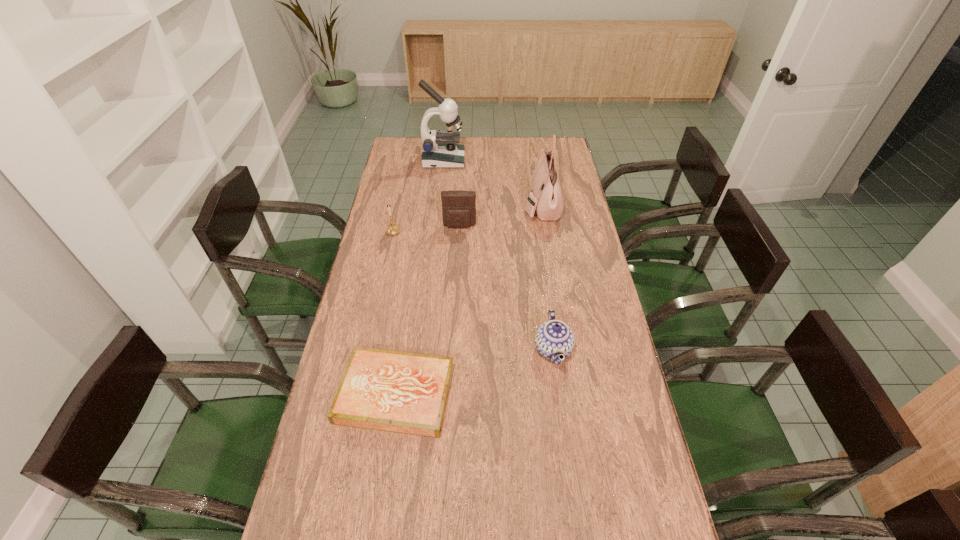
You are a GUI agent. You are given a task and a screenshot of the screen. Output one action in this format:
    pyautogui.click(x=<x>, y=<y>)
    Task: Click on the free space that is in between the shortest object and the handbag
    This screenshot has height=540, width=960.
    Given the screenshot: What is the action you would take?
    pyautogui.click(x=468, y=299)

You are a GUI agent. You are given a task and a screenshot of the screen. Output one action in this format:
    pyautogui.click(x=<x>, y=<y>)
    Task: Click on the vacant space in between the shortest object and the pouch
    The width and height of the screenshot is (960, 540).
    Given the screenshot: What is the action you would take?
    pyautogui.click(x=427, y=310)

This screenshot has width=960, height=540. I want to click on blank region between the farthest object and the chinaware, so click(x=498, y=255).

The height and width of the screenshot is (540, 960). I want to click on free space between the microscope and the hardback book, so click(x=420, y=277).

Where is `vacant space that is in between the candle holder and the farthest object`? The height and width of the screenshot is (540, 960). vacant space that is in between the candle holder and the farthest object is located at coordinates (419, 195).

Locate an element on the screen. The image size is (960, 540). free spot between the hardback book and the farthest object is located at coordinates (420, 277).

This screenshot has width=960, height=540. What are the coordinates of `vacant area between the hardback book and the chinaware` in the screenshot? It's located at (474, 372).

Choose which object is the third nearest neighbor to the candle holder. Please provide its 2D coordinates. Your answer should be formatted as a tuple, i.e. [(x, y)], where the tuple contains the x and y coordinates of a point satisfying the conditions above.

[(547, 199)]

Where is `object that is the second closest to the pouch`? Image resolution: width=960 pixels, height=540 pixels. object that is the second closest to the pouch is located at coordinates (547, 199).

Where is `blank space that satisfies the following two spatial constraints: 1. on the side of the second tallest object with the attached pouch; 2. on the front side of the shortest object`? Image resolution: width=960 pixels, height=540 pixels. blank space that satisfies the following two spatial constraints: 1. on the side of the second tallest object with the attached pouch; 2. on the front side of the shortest object is located at coordinates (572, 394).